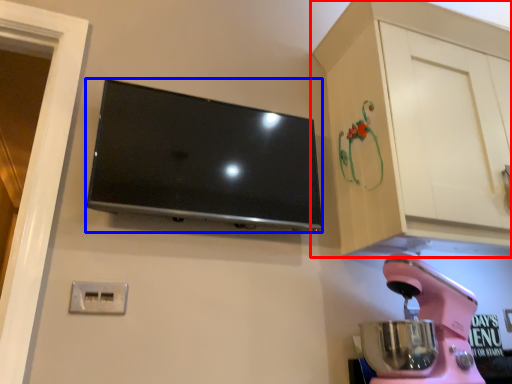
Question: Among these objects, which one is farthest to the camera, cabinetry (highlighted by a red box) or television (highlighted by a blue box)?

Choices:
 (A) cabinetry
 (B) television

Answer: (B)